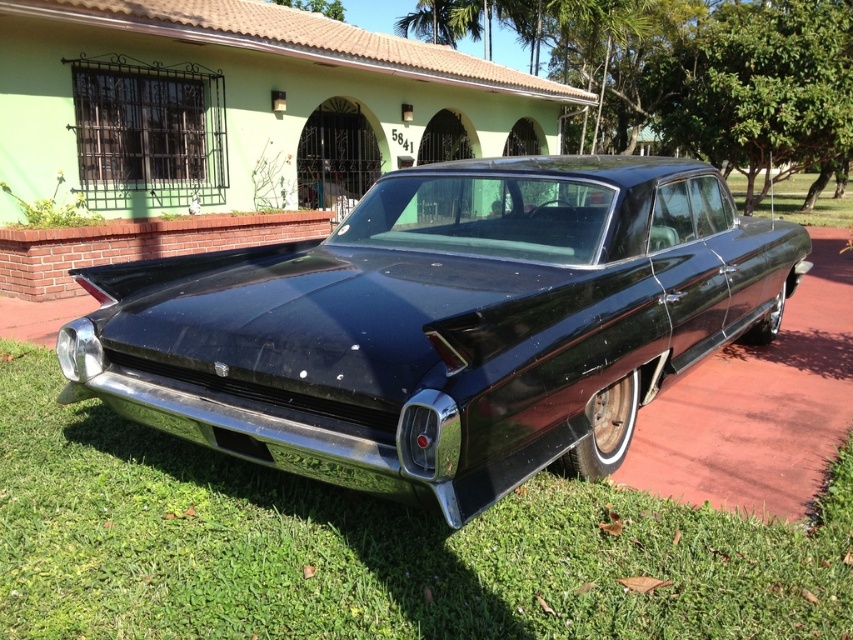
You are standing at the point marked as point (444, 324). What object are you currently standing on?

You are standing on the glossy black car at center.

You are a gardener with a 1.2 meter long hose. You need to water the green grass at lower center from the glossy black car at center. Can you reach the grass with your hose?

The distance between the glossy black car at center and the green grass at lower center is 1.18 meters, so the 1.2 meter hose is long enough to reach the grass.

You are a delivery person trying to park your van next to the glossy black car at center and the green grass at lower center. Since the van is 6 meters long, will there be enough space on the driveway?

The glossy black car at center is bigger than green grass at lower center, but the description does not provide specific measurements about the driveway size or the distance between the objects. Therefore, it is impossible to determine if there is enough space for the van.